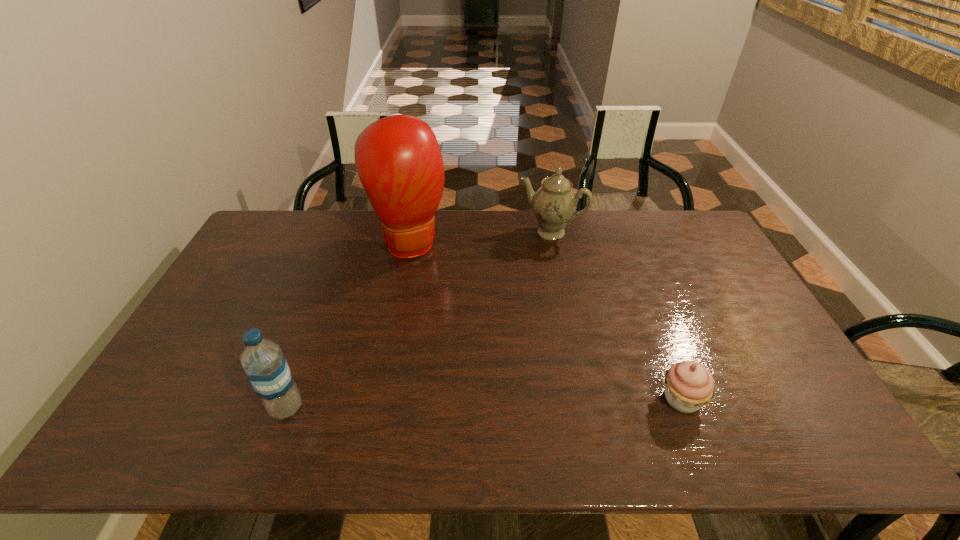
Image resolution: width=960 pixels, height=540 pixels. Identify the location of vacant point located 0.210m on the spout of the second object from right to left. (518, 281).

Where is `vacant space located on the spout of the second object from right to left`? vacant space located on the spout of the second object from right to left is located at coordinates (535, 252).

You are a GUI agent. You are given a task and a screenshot of the screen. Output one action in this format:
    pyautogui.click(x=<x>, y=<y>)
    Task: Click on the free region located on the spout of the second object from right to left
    The height and width of the screenshot is (540, 960).
    Given the screenshot: What is the action you would take?
    pyautogui.click(x=518, y=281)

Identify the location of boxing glove situated at the far edge. Image resolution: width=960 pixels, height=540 pixels. (398, 159).

Find the location of `chinaware at the far edge`. chinaware at the far edge is located at coordinates (554, 204).

Where is `water bottle present at the near edge`? water bottle present at the near edge is located at coordinates (264, 363).

Find the location of `cupcake situated at the near edge`. cupcake situated at the near edge is located at coordinates (689, 386).

Find the location of a particular element. free location at the far edge is located at coordinates (331, 213).

You are a GUI agent. You are given a task and a screenshot of the screen. Output one action in this format:
    pyautogui.click(x=<x>, y=<y>)
    Task: Click on the free space at the left edge of the desktop
    
    Given the screenshot: What is the action you would take?
    pyautogui.click(x=166, y=372)

The image size is (960, 540). I want to click on vacant space at the right edge, so click(734, 300).